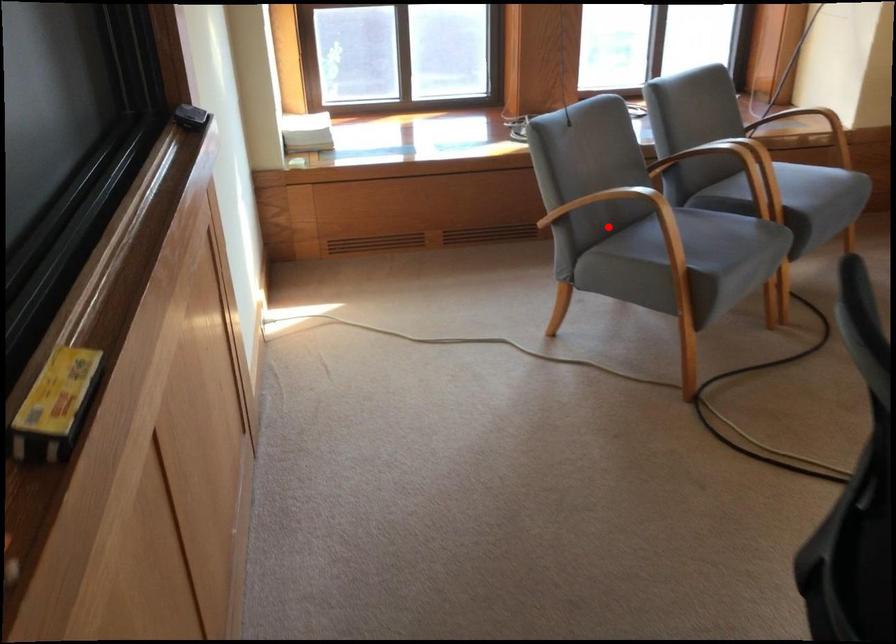
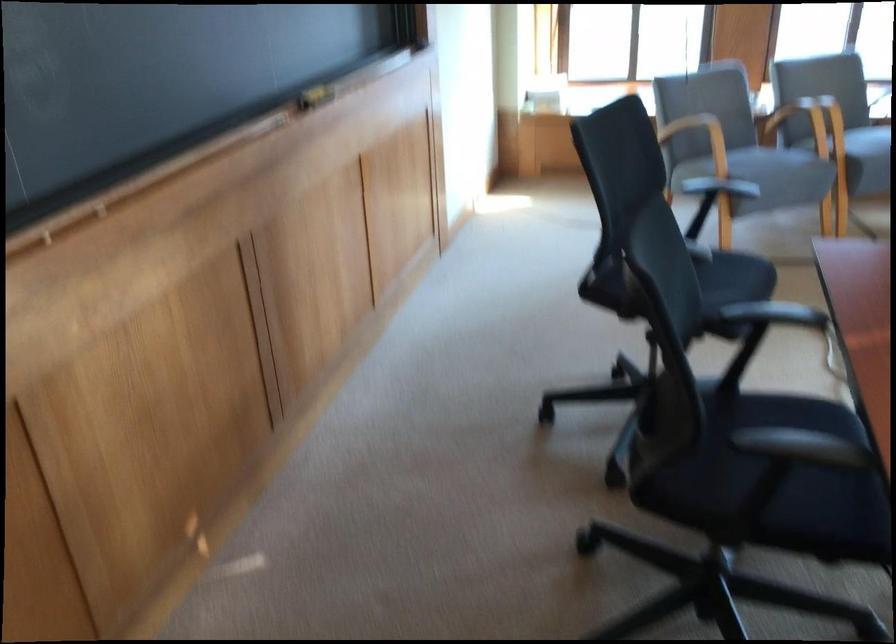
Find the pixel in the second image that matches the highlighted location in the first image.

(700, 138)